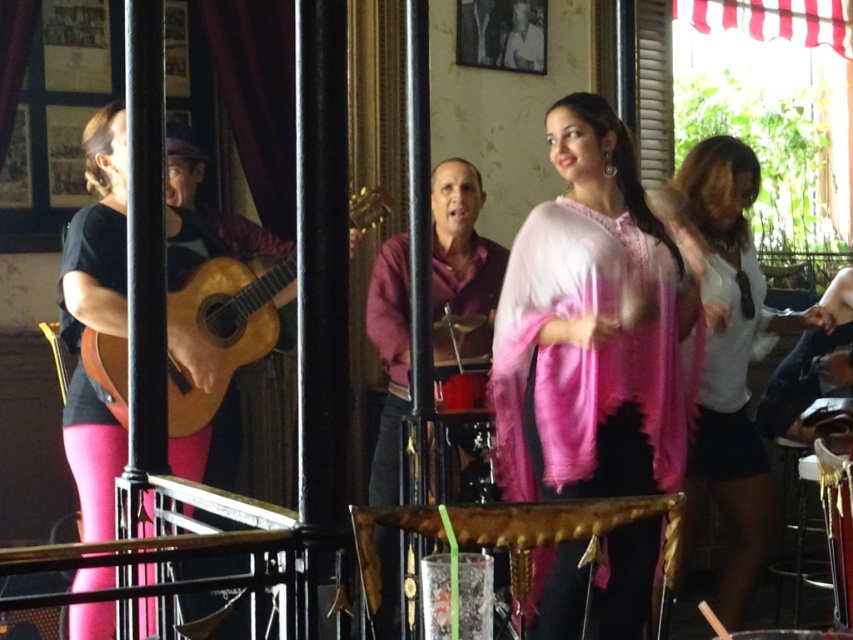
Question: Which point is farther to the camera?

Choices:
 (A) (735, 589)
 (B) (122, 346)

Answer: (A)

Question: In this image, where is pink textured scarf at center located relative to maroon sweater at center?

Choices:
 (A) right
 (B) left

Answer: (A)

Question: Which point is farther to the camera?

Choices:
 (A) (90, 364)
 (B) (723, 266)
 (C) (683, 358)
 (D) (433, 301)

Answer: (D)

Question: Is maroon sweater at center below wooden acoustic guitar at left?

Choices:
 (A) no
 (B) yes

Answer: (B)

Question: Where is pink textured scarf at center located in relation to wooden acoustic guitar at left in the image?

Choices:
 (A) right
 (B) left

Answer: (A)

Question: Which point appears farthest from the camera in this image?

Choices:
 (A) (489, 317)
 (B) (601, 161)

Answer: (A)